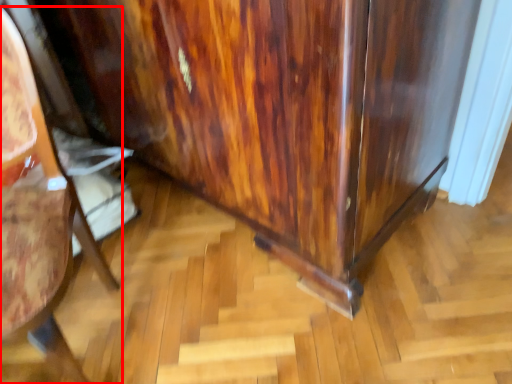
Question: From the image's perspective, what is the correct spatial positioning of furniture (annotated by the red box) in reference to dresser?

Choices:
 (A) above
 (B) below

Answer: (B)